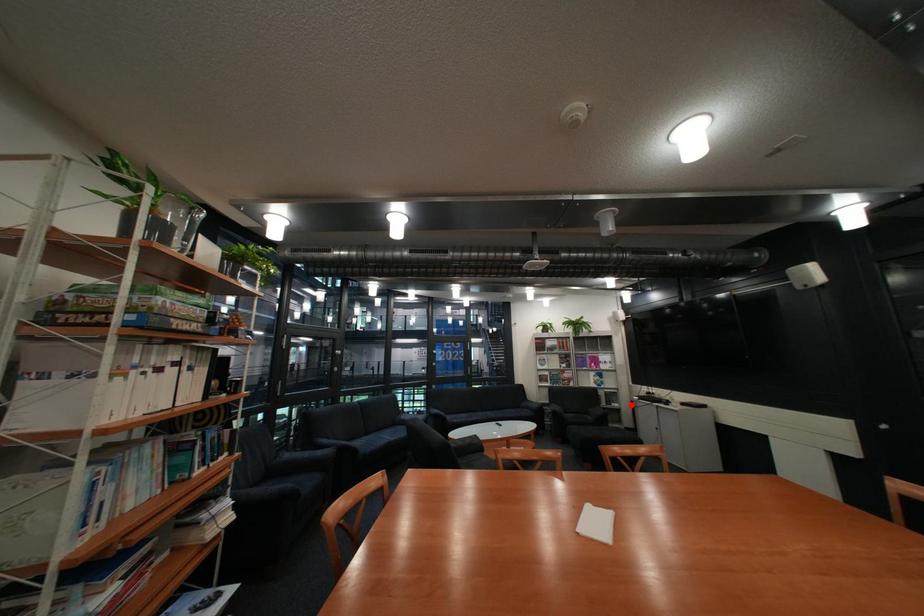
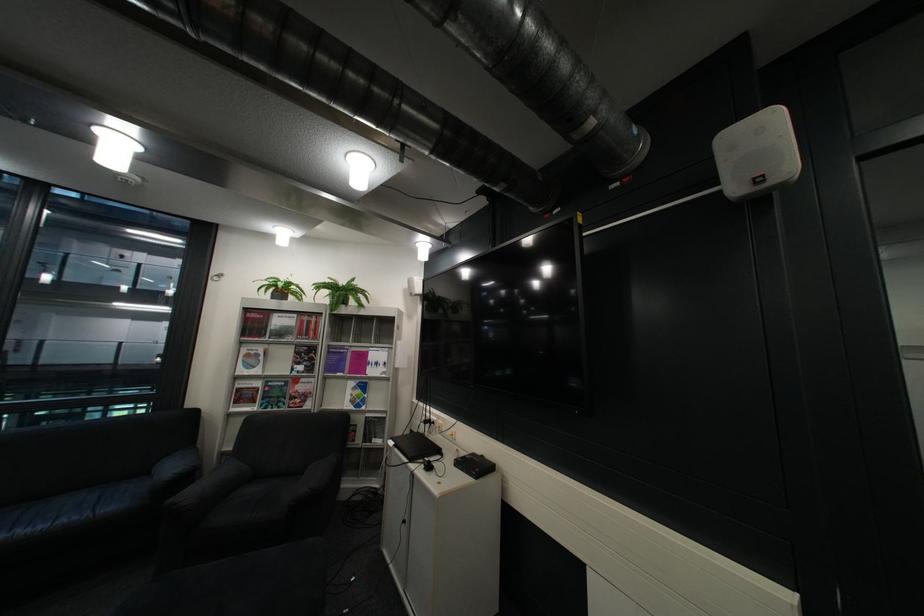
Question: I am providing you with two images of the same scene from different viewpoints. Given a red point in image1, look at the same physical point in image2. Is it:

Choices:
 (A) Closer to the viewpoint
 (B) Farther from the viewpoint

Answer: (A)